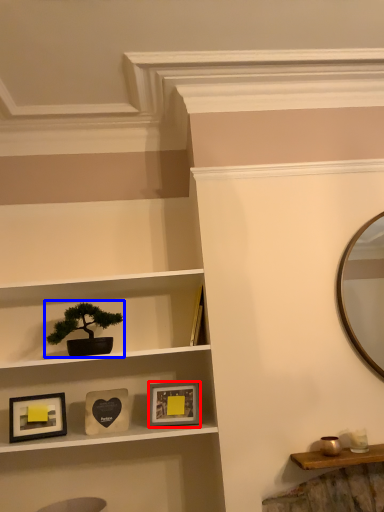
Question: Among these objects, which one is farthest to the camera, picture frame (highlighted by a red box) or houseplant (highlighted by a blue box)?

Choices:
 (A) picture frame
 (B) houseplant

Answer: (A)